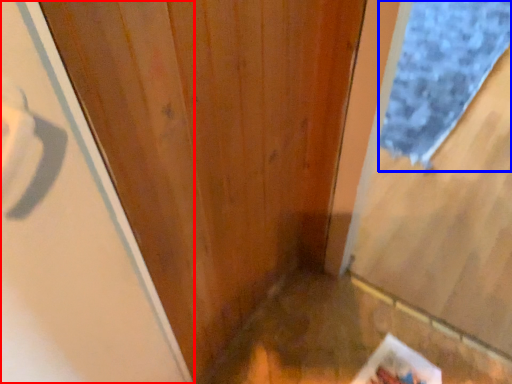
Question: Which point is closer to the camera, screen door (highlighted by a red box) or doormat (highlighted by a blue box)?

Choices:
 (A) screen door
 (B) doormat

Answer: (A)